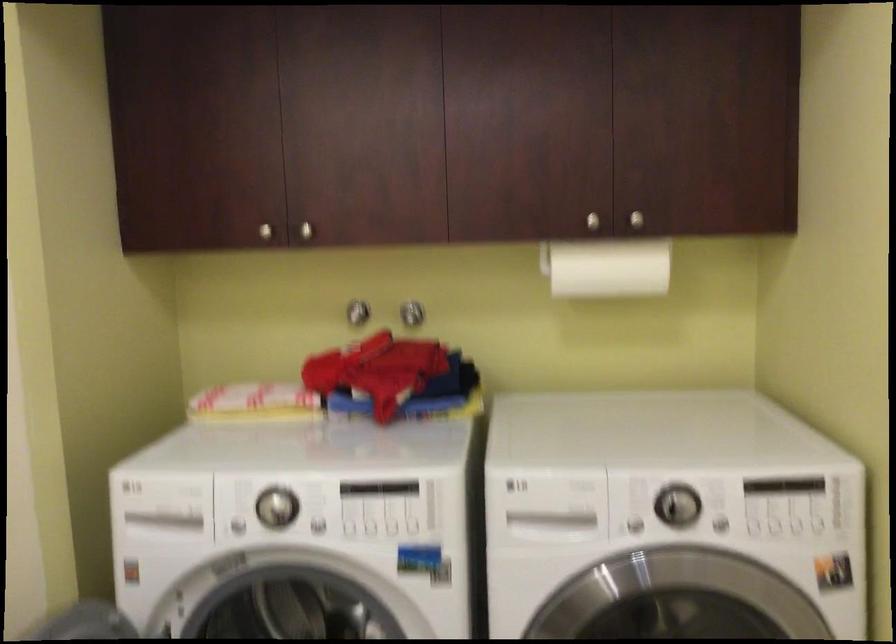
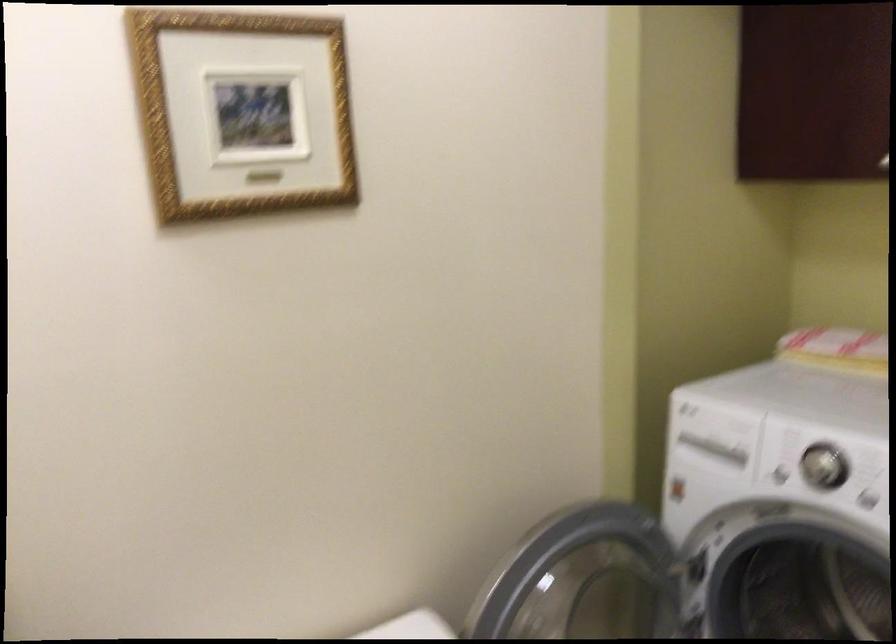
Question: How did the camera likely rotate?

Choices:
 (A) Left
 (B) Right
 (C) Up
 (D) Down

Answer: (A)